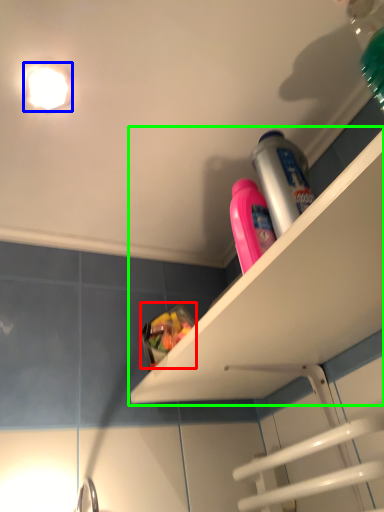
Question: Considering the real-world distances, which object is closest to food (highlighted by a red box)? light fixture (highlighted by a blue box) or shelf (highlighted by a green box).

Choices:
 (A) light fixture
 (B) shelf

Answer: (B)